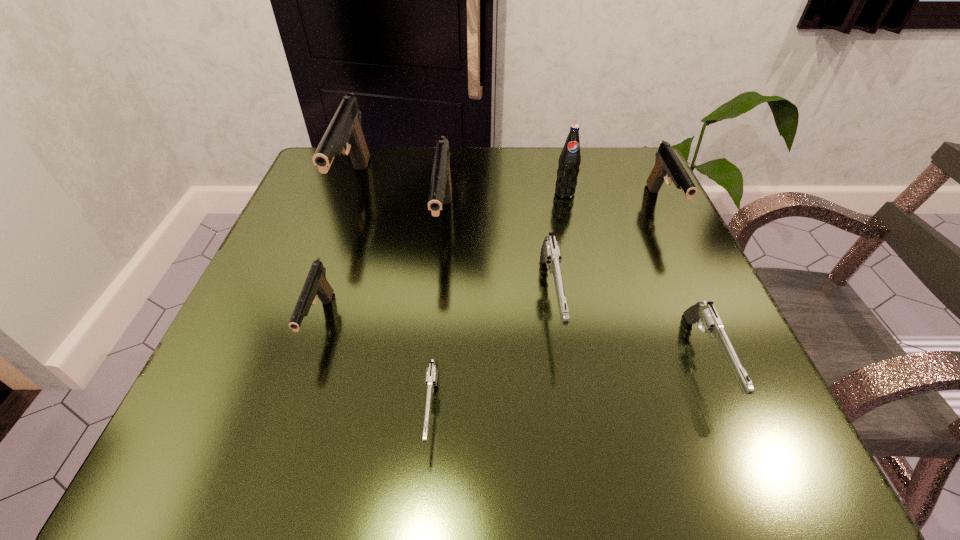
Identify the location of the second pistol from right to left. This screenshot has width=960, height=540. (704, 314).

Find the location of a particular element. the rightmost silver pistol is located at coordinates (704, 314).

At what (x,y) coordinates should I click in order to perform the action: click on the smallest silver pistol. Please return your answer as a coordinate pair (x, y). Image resolution: width=960 pixels, height=540 pixels. Looking at the image, I should click on (431, 374).

Locate an element on the screen. the leftmost silver pistol is located at coordinates (431, 374).

The width and height of the screenshot is (960, 540). Identify the location of free region located at the muzzle of the tallest pistol. (321, 284).

At what (x,y) coordinates should I click in order to perform the action: click on blank space located on the front label of the sixth object from left to right. Please return your answer as a coordinate pair (x, y). The width and height of the screenshot is (960, 540). Looking at the image, I should click on (587, 284).

You are a GUI agent. You are given a task and a screenshot of the screen. Output one action in this format:
    pyautogui.click(x=<x>, y=<y>)
    Task: Click on the vacant region located at the muzzle of the third smallest black pistol
    
    Given the screenshot: What is the action you would take?
    pyautogui.click(x=438, y=287)

At what (x,y) coordinates should I click in order to perform the action: click on free space located 0.140m at the muzzle of the fifth shortest pistol. Please return your answer as a coordinate pair (x, y). This screenshot has width=960, height=540. Looking at the image, I should click on (702, 288).

The width and height of the screenshot is (960, 540). I want to click on vacant space positioned on the front-facing side of the third pistol from right to left, so click(x=564, y=386).

This screenshot has width=960, height=540. What are the coordinates of `vacant space located at the muzzle of the smallest black pistol` in the screenshot? It's located at (276, 461).